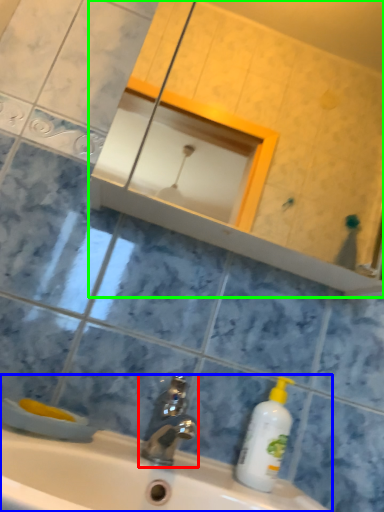
Question: Considering the real-world distances, which object is closest to tap (highlighted by a red box)? sink (highlighted by a blue box) or mirror (highlighted by a green box).

Choices:
 (A) sink
 (B) mirror

Answer: (A)